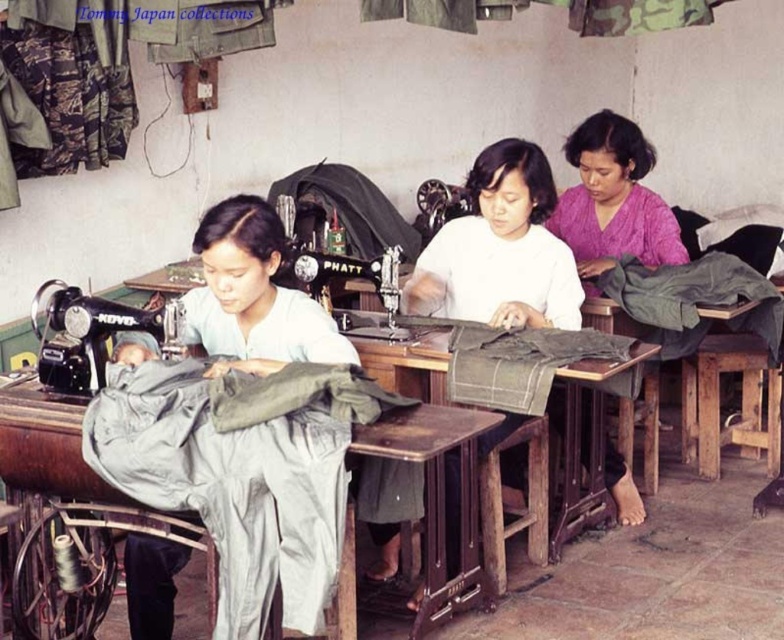
You are a tailor who needs to place a large fabric roll that is 1.2 meters wide on the wooden table at center. The metallic black sewing machine at center is currently occupying space on the table. Can the fabric roll fit on the table if you move the sewing machine?

The wooden table at center might be wider than the metallic black sewing machine at center, so if you move the sewing machine, there could be enough space to fit the 1.2 meter wide fabric roll. However, the exact width of the table isn not specified, so it depends on how much wider the table is compared to the sewing machine.

You are a new worker in the sewing workshop. You need to place a fabric roll on the wooden table at center. However, there is a metallic black sewing machine at center in the way. Can you place the fabric roll on the table without moving the sewing machine?

The wooden table at center is in front of the metallic black sewing machine at center, meaning the sewing machine is behind the table. Therefore, you can place the fabric roll on the wooden table at center without moving the sewing machine since the machine is positioned behind it.

You are standing in the sewing workshop and need to place a new sewing machine on the wooden table at center. The table has a coordinate system where the bottom left corner is the origin. The point given is in normalized coordinates. Can you confirm if the point you see at coordinate [517,369] is located on the wooden table at center?

Yes, the point at coordinate [517,369] is located on the wooden table at center as indicated by the description.